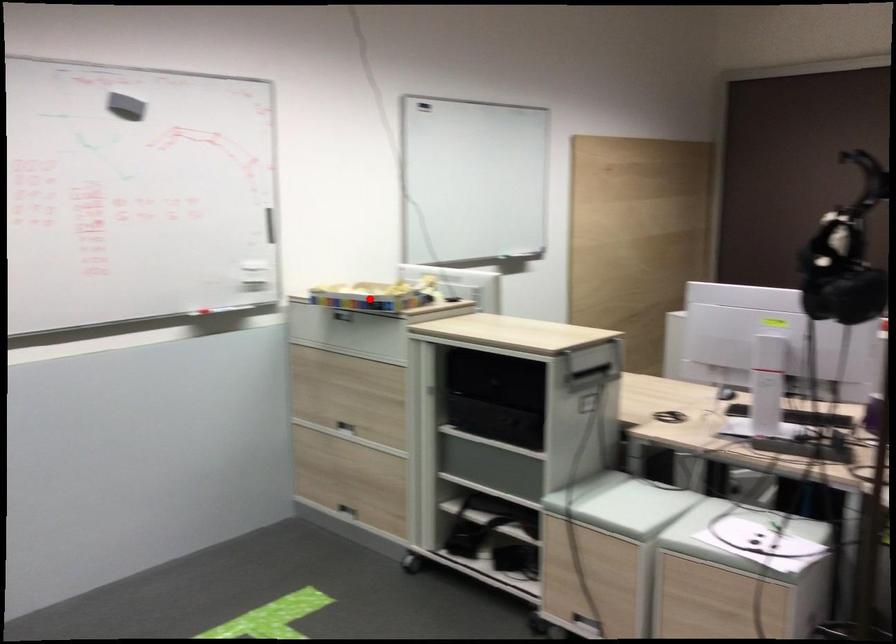
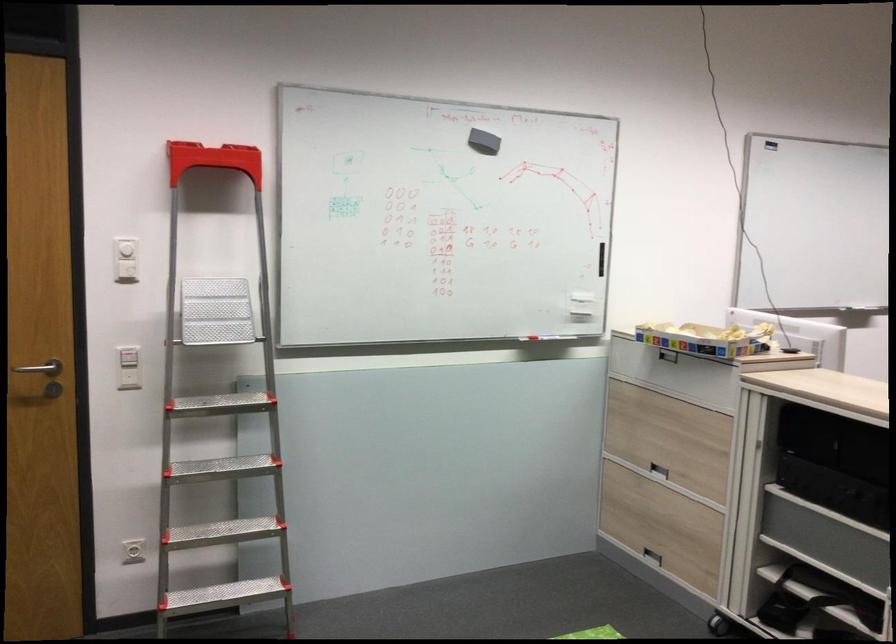
In the second image, find the point that corresponds to the highlighted location in the first image.

(705, 339)